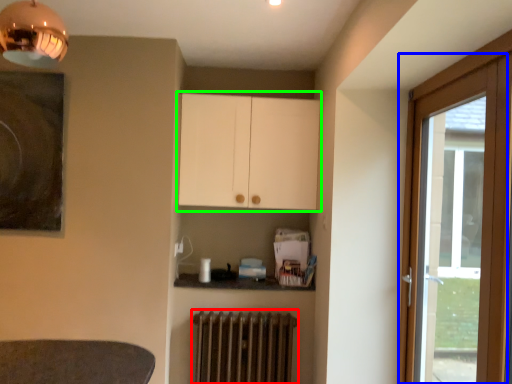
Question: Estimate the real-world distances between objects in this image. Which object is farther from radiator (highlighted by a red box), door (highlighted by a blue box) or cabinetry (highlighted by a green box)?

Choices:
 (A) door
 (B) cabinetry

Answer: (A)